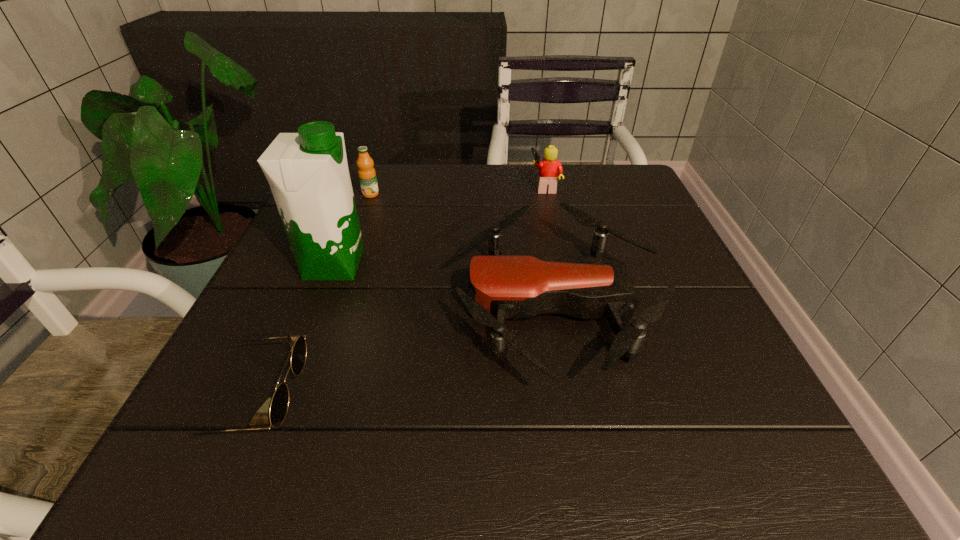
Where is `object present at the right edge`? The image size is (960, 540). object present at the right edge is located at coordinates (502, 287).

Identify the location of object that is at the far left corner. (367, 176).

Find the location of a particular element. object located in the near left corner section of the desktop is located at coordinates (279, 405).

The height and width of the screenshot is (540, 960). In order to click on free spot at the far edge of the desktop in this screenshot , I will do `click(461, 165)`.

This screenshot has width=960, height=540. I want to click on free space at the near edge of the desktop, so click(x=408, y=421).

Image resolution: width=960 pixels, height=540 pixels. What are the coordinates of `free space at the left edge of the desktop` in the screenshot? It's located at (285, 261).

Locate an element on the screen. Image resolution: width=960 pixels, height=540 pixels. free location at the right edge of the desktop is located at coordinates (708, 406).

The width and height of the screenshot is (960, 540). I want to click on vacant space at the far right corner, so click(x=617, y=209).

Where is `vacant area that lies between the sunglasses and the orange juice`? The width and height of the screenshot is (960, 540). vacant area that lies between the sunglasses and the orange juice is located at coordinates (312, 297).

The height and width of the screenshot is (540, 960). I want to click on empty location between the soya milk and the drone, so click(444, 285).